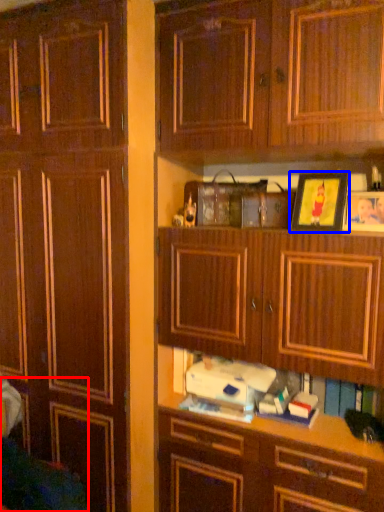
Question: Which point is further to the camera, swivel chair (highlighted by a red box) or picture frame (highlighted by a blue box)?

Choices:
 (A) swivel chair
 (B) picture frame

Answer: (B)